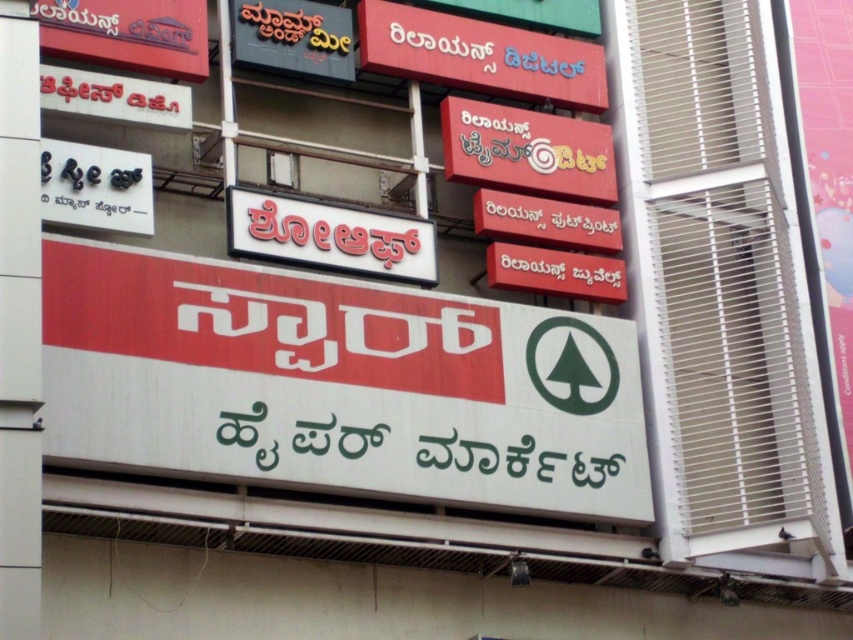
You are standing in front of a building with several signs. There is a point at coordinates [337,385]. What object is located at that point?

The white matte signboard at center is located at point [337,385].